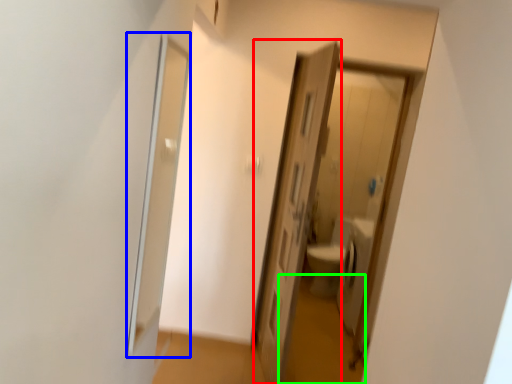
Question: Based on their relative distances, which object is nearer to door (highlighted by a red box)? Choose from screen door (highlighted by a blue box) and path (highlighted by a green box).

Choices:
 (A) screen door
 (B) path

Answer: (A)